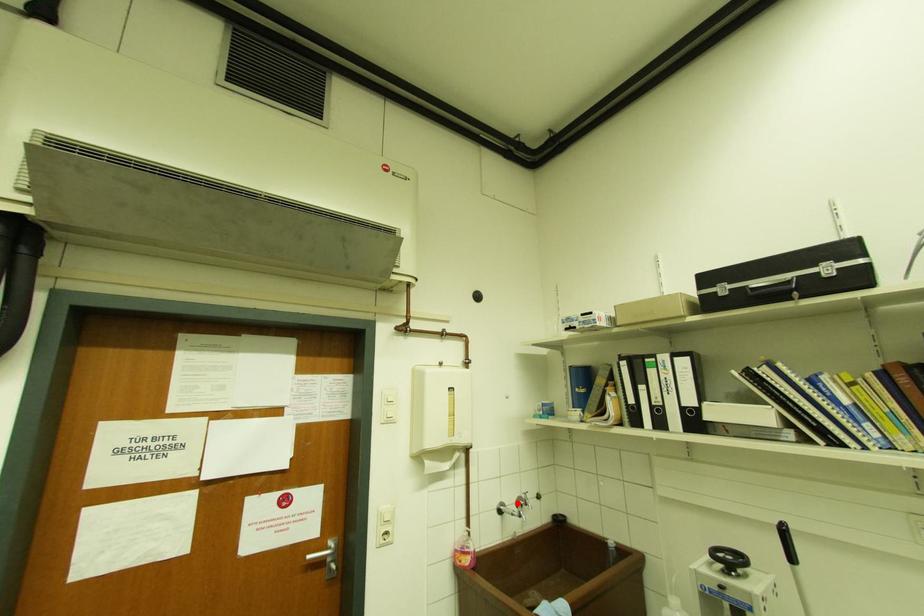
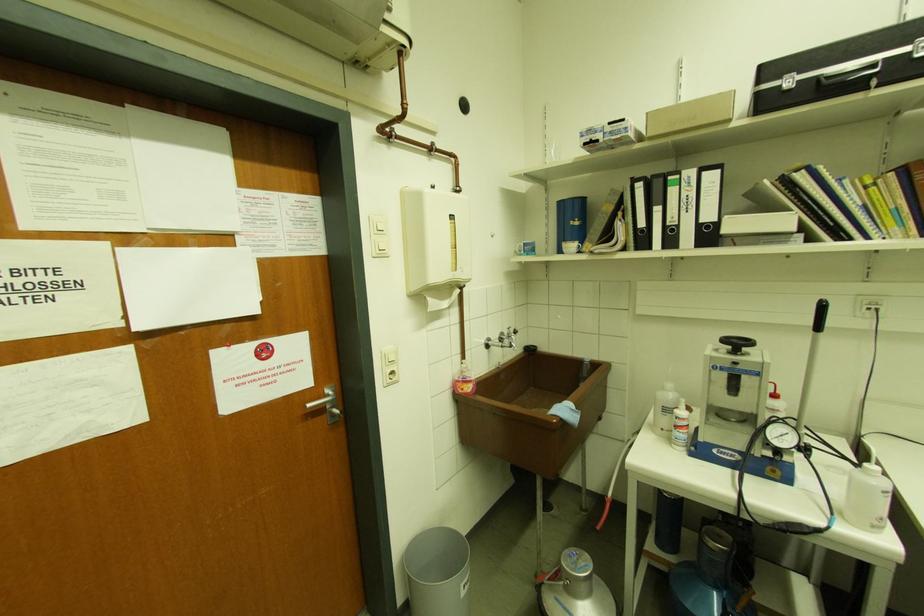
Question: A red point is marked in image1. In image2, is the corresponding 3D point closer to the camera or farther? Reply with the corresponding letter.

Choices:
 (A) The corresponding 3D point is closer.
 (B) The corresponding 3D point is farther.

Answer: (A)